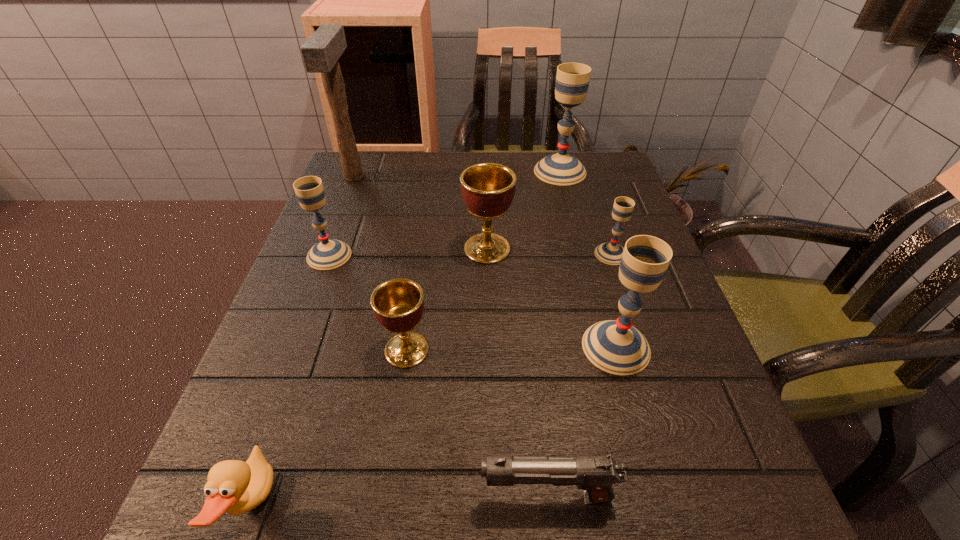
Where is `free point that satisfies the following two spatial constraints: 1. on the front side of the third tallest object; 2. on the right side of the third biggest gray chalice`? free point that satisfies the following two spatial constraints: 1. on the front side of the third tallest object; 2. on the right side of the third biggest gray chalice is located at coordinates (295, 347).

Find the location of a particular element. free spot that satisfies the following two spatial constraints: 1. on the back side of the fifth chalice from right to left; 2. on the right side of the nearest gray chalice is located at coordinates pos(407,347).